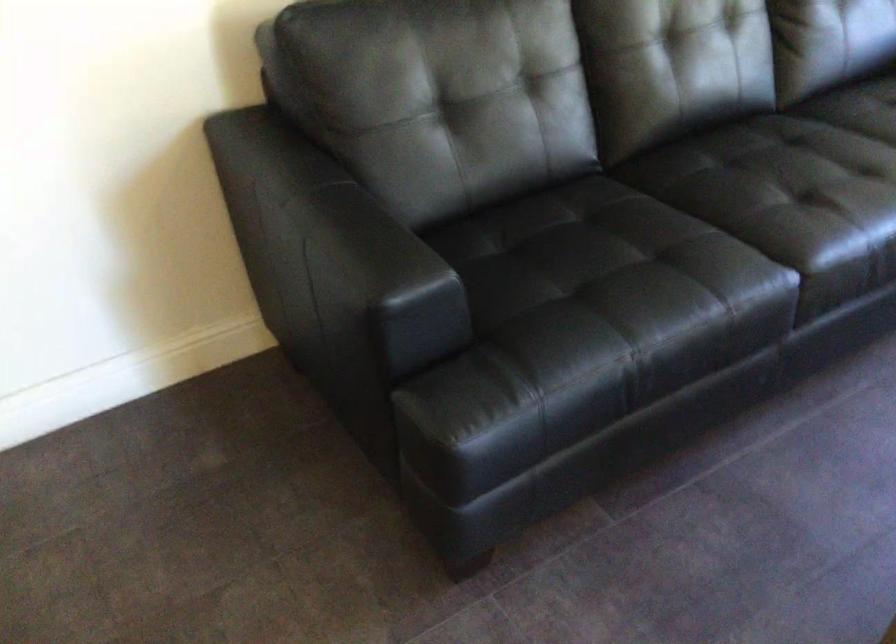
What do you see at coordinates (332, 263) in the screenshot? The width and height of the screenshot is (896, 644). I see `a black sofa armrest` at bounding box center [332, 263].